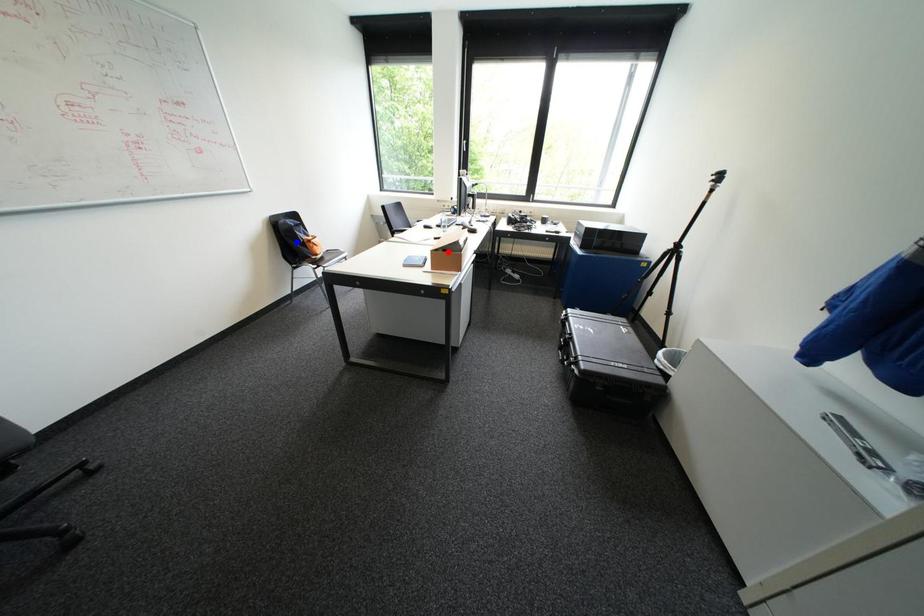
Question: Two points are marked on the image. Which point is closer to the camera?

Choices:
 (A) Blue point is closer.
 (B) Red point is closer.

Answer: (B)